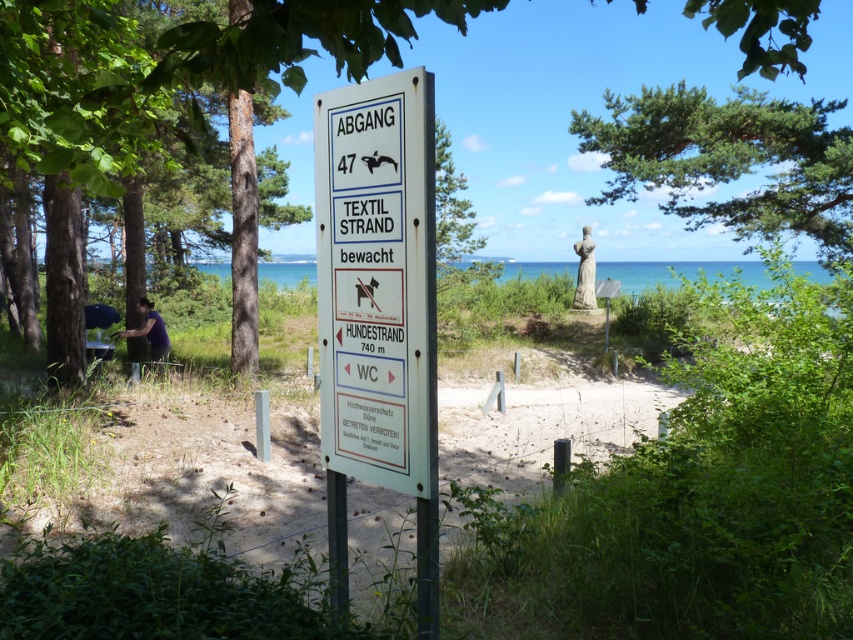
Question: Can you confirm if green leafy tree at upper center is positioned below stone statue at center?

Choices:
 (A) no
 (B) yes

Answer: (A)

Question: Which of the following is the closest to the observer?

Choices:
 (A) (531, 410)
 (B) (374, 138)
 (C) (144, 323)
 (D) (247, 131)

Answer: (B)

Question: Which of the following is the closest to the observer?

Choices:
 (A) (137, 332)
 (B) (210, 61)
 (C) (701, 176)

Answer: (B)

Question: Can you confirm if green leafy tree at upper center is bigger than blue water at center?

Choices:
 (A) no
 (B) yes

Answer: (B)

Question: Which object is the farthest from the green leafy tree at left?

Choices:
 (A) green textured tree at upper right
 (B) purple fabric shirt at lower left
 (C) blue water at center
 (D) green leafy tree at upper center

Answer: (C)

Question: Is the position of green leafy tree at upper center less distant than that of purple fabric shirt at lower left?

Choices:
 (A) yes
 (B) no

Answer: (A)